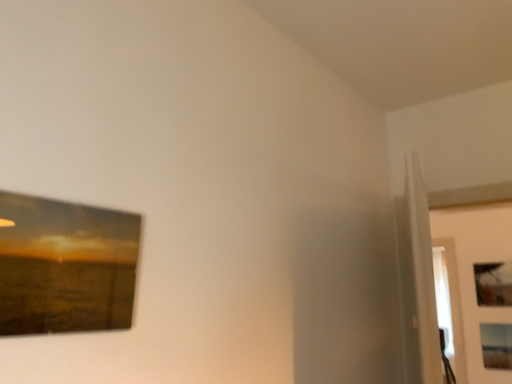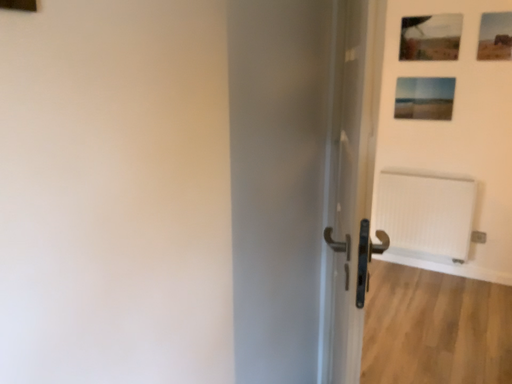
Question: Which way did the camera rotate in the video?

Choices:
 (A) rotated downward
 (B) rotated upward

Answer: (A)